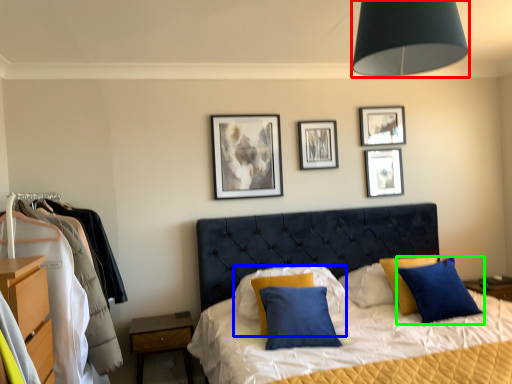
Question: Which object is positioned farthest from light fixture (highlighted by a red box)? Select from pillow (highlighted by a blue box) and pillow (highlighted by a green box).

Choices:
 (A) pillow
 (B) pillow

Answer: (A)